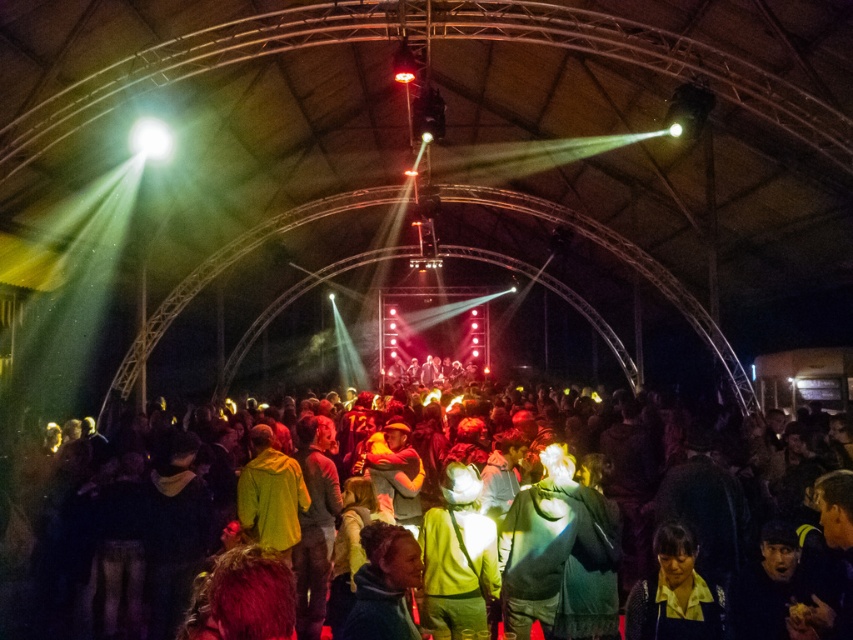
You are a photographer trying to capture a clear shot of both the matte green jacket at center and the yellow fabric shirt at lower right. However, you notice that one of the subjects is blocking the view of the other. Which subject is blocking the other?

The yellow fabric shirt at lower right is behind the matte green jacket at center, so the matte green jacket at center is blocking the view of the yellow fabric shirt at lower right.

You are a photographer standing in the center of the dome structure. You see the green fabric shirt at center and the yellow fabric shirt at lower right. Which one would cast a longer shadow due to their height difference?

The green fabric shirt at center is much taller than the yellow fabric shirt at lower right, so it would cast a longer shadow.

You are a photographer standing at the entrance of the tent. You want to capture a photo that includes both the multicolored fabric crowd at center and the green fabric jacket at center. Based on their positions, which object should you focus on first to ensure both are in the frame?

The multicolored fabric crowd at center is to the right of the green fabric jacket at center. To include both in the frame, focus on the green fabric jacket at center first as it is on the left side, ensuring the rightward placement of the crowd remains within the shot.